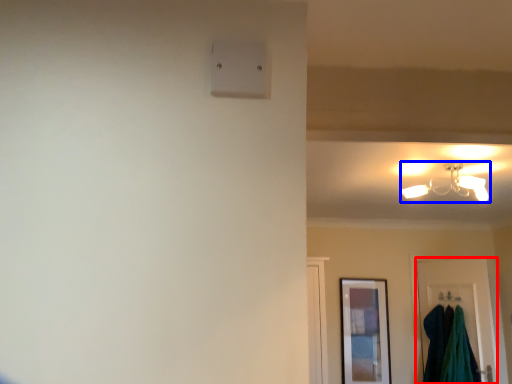
Question: Which object appears closest to the camera in this image, door (highlighted by a red box) or lamp (highlighted by a blue box)?

Choices:
 (A) door
 (B) lamp

Answer: (B)